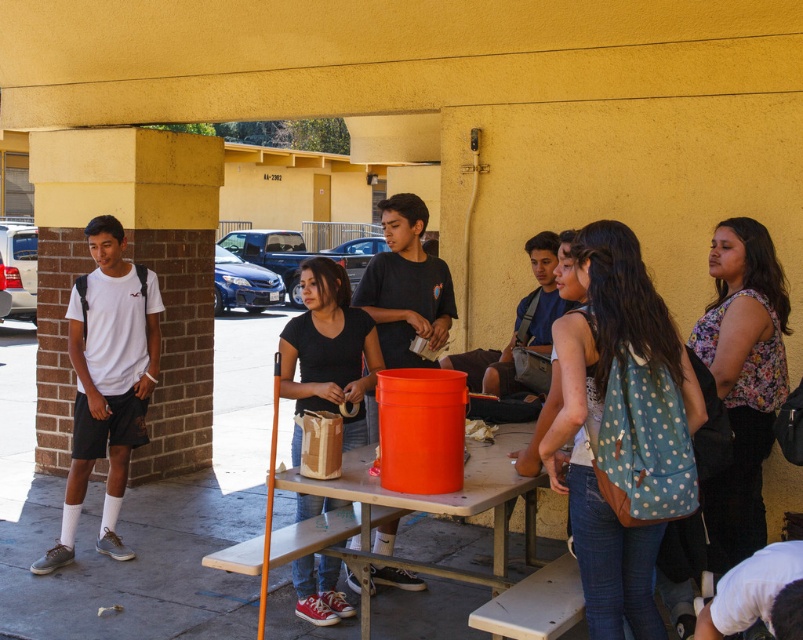
Question: Can you confirm if white matte t-shirt at left is wider than matte black shirt at center?

Choices:
 (A) yes
 (B) no

Answer: (A)

Question: Does wooden picnic table at center appear on the left side of matte black shirt at center?

Choices:
 (A) yes
 (B) no

Answer: (B)

Question: Is white matte t-shirt at left closer to camera compared to matte black shirt at center?

Choices:
 (A) yes
 (B) no

Answer: (B)

Question: Which object is the farthest from the matte black backpack at center?

Choices:
 (A) matte black shirt at center
 (B) wooden picnic table at center

Answer: (B)

Question: Which of the following is the closest to the observer?

Choices:
 (A) (522, 438)
 (B) (79, 291)

Answer: (A)

Question: Which point is farther from the camera taking this photo?

Choices:
 (A) (402, 205)
 (B) (345, 454)
 (C) (545, 280)

Answer: (C)